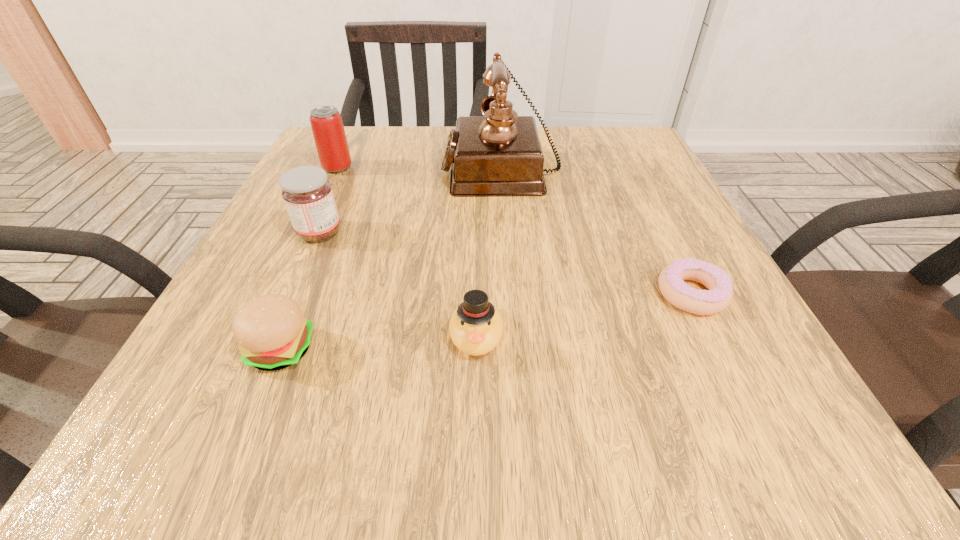
Image resolution: width=960 pixels, height=540 pixels. In order to click on free area in between the third shortest object and the fifth tallest object in this screenshot , I will do `click(378, 342)`.

You are a GUI agent. You are given a task and a screenshot of the screen. Output one action in this format:
    pyautogui.click(x=<x>, y=<y>)
    Task: Click on the empty location between the beer can and the rightmost object
    
    Given the screenshot: What is the action you would take?
    pyautogui.click(x=515, y=231)

Locate an element on the screen. vacant space that is in between the jam and the fifth tallest object is located at coordinates (300, 291).

I want to click on free spot between the beer can and the tallest object, so click(420, 167).

Where is `vacant space in between the hamburger and the beer can`? Image resolution: width=960 pixels, height=540 pixels. vacant space in between the hamburger and the beer can is located at coordinates (309, 259).

The height and width of the screenshot is (540, 960). I want to click on free spot between the third shortest object and the beer can, so tap(407, 251).

Where is `empty space that is in between the jam and the rightmost object`? The width and height of the screenshot is (960, 540). empty space that is in between the jam and the rightmost object is located at coordinates (506, 263).

Locate which object is the third closest to the hamburger. Please provide its 2D coordinates. Your answer should be formatted as a tuple, i.e. [(x, y)], where the tuple contains the x and y coordinates of a point satisfying the conditions above.

[(499, 154)]

Identify the location of object that is the fifth nearest to the duck. The image size is (960, 540). (327, 126).

Find the location of a particular element. The image size is (960, 540). free region that satisfies the following two spatial constraints: 1. on the front side of the hamburger; 2. on the left side of the beer can is located at coordinates (252, 349).